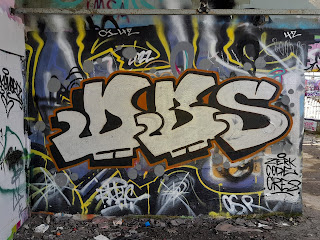
Where is `1 heart on left wall`? 1 heart on left wall is located at coordinates (8, 106).